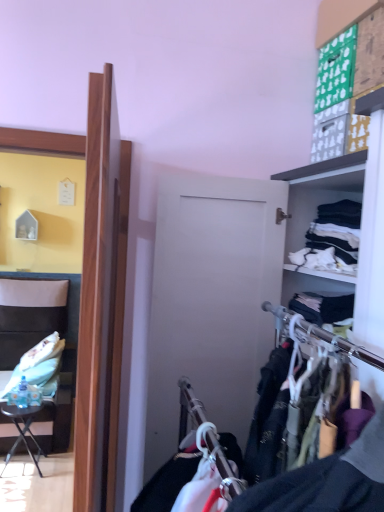
Question: Does white cotton shirts at right, which is the second clothing from left to right, have a lesser width compared to leatherette chair at left?

Choices:
 (A) no
 (B) yes

Answer: (B)

Question: Is white cotton shirts at right, the 1th clothing from the right, at the right side of leatherette chair at left?

Choices:
 (A) no
 (B) yes

Answer: (B)

Question: Is the surface of white cotton shirts at right, which is the 2th clothing from back to front, in direct contact with leatherette chair at left?

Choices:
 (A) yes
 (B) no

Answer: (B)

Question: Does white cotton shirts at right, the 1th clothing in the top-to-bottom sequence, lie behind leatherette chair at left?

Choices:
 (A) yes
 (B) no

Answer: (B)

Question: Is white cotton shirts at right, the 1th clothing from the right, shorter than leatherette chair at left?

Choices:
 (A) yes
 (B) no

Answer: (A)

Question: From a real-world perspective, does white cotton shirts at right, which is the second clothing from left to right, stand above leatherette chair at left?

Choices:
 (A) yes
 (B) no

Answer: (A)

Question: From a real-world perspective, is black metal table at lower left on white cotton shirts at right, the 1th clothing from the right?

Choices:
 (A) yes
 (B) no

Answer: (B)

Question: Considering the relative sizes of black metal table at lower left and white cotton shirts at right, which is the second clothing from bottom to top, in the image provided, is black metal table at lower left wider than white cotton shirts at right, which is the second clothing from bottom to top,?

Choices:
 (A) no
 (B) yes

Answer: (B)

Question: Is black metal table at lower left further to camera compared to white cotton shirts at right, which is the second clothing from bottom to top?

Choices:
 (A) yes
 (B) no

Answer: (A)

Question: Is the depth of black metal table at lower left less than that of white cotton shirts at right, which is the second clothing from bottom to top?

Choices:
 (A) no
 (B) yes

Answer: (A)

Question: Considering the relative positions of black metal table at lower left and white cotton shirts at right, which is the 2th clothing from back to front, in the image provided, is black metal table at lower left to the left of white cotton shirts at right, which is the 2th clothing from back to front, from the viewer's perspective?

Choices:
 (A) no
 (B) yes

Answer: (B)

Question: Is black metal table at lower left in contact with white cotton shirts at right, the 1th clothing from the right?

Choices:
 (A) no
 (B) yes

Answer: (A)

Question: Is leatherette chair at left in front of white cotton shirts at right, which is the 2th clothing from back to front?

Choices:
 (A) yes
 (B) no

Answer: (B)